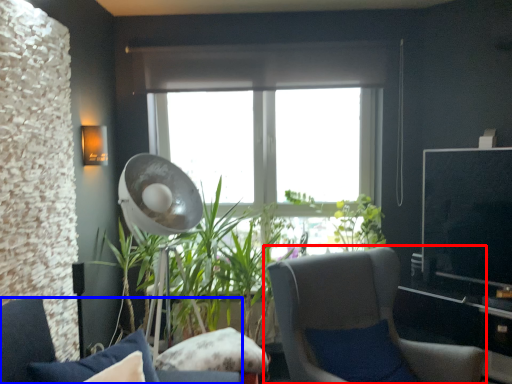
Question: Among these objects, which one is nearest to the camera, chair (highlighted by a red box) or chair (highlighted by a blue box)?

Choices:
 (A) chair
 (B) chair

Answer: (B)